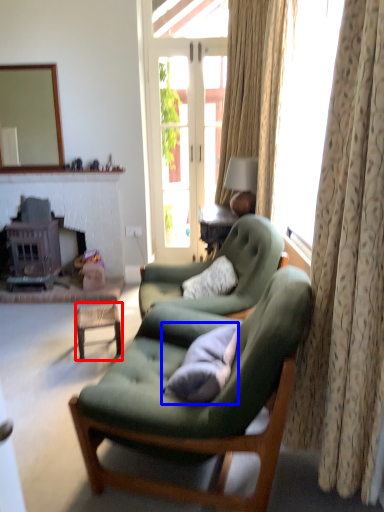
Question: Which object is further to the camera taking this photo, table (highlighted by a red box) or pillow (highlighted by a blue box)?

Choices:
 (A) table
 (B) pillow

Answer: (A)